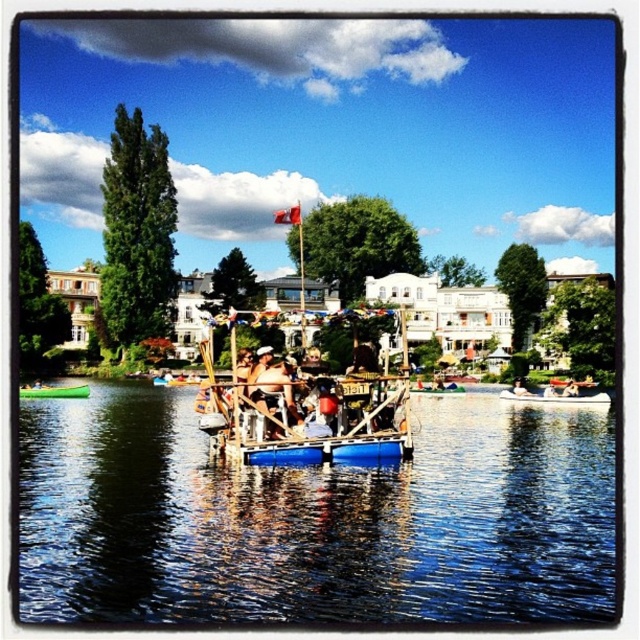
Is wooden raft at center wider than green plastic canoe at lower left?

Correct, the width of wooden raft at center exceeds that of green plastic canoe at lower left.

Is wooden raft at center further to camera compared to green plastic canoe at lower left?

No.

Between point (332, 380) and point (29, 388), which one is positioned behind?

The point (29, 388) is more distant.

Identify the location of wooden raft at center. (307, 410).

Does blue wooden raft at center have a greater width compared to wooden raft at center?

Indeed, blue wooden raft at center has a greater width compared to wooden raft at center.

Between blue wooden raft at center and wooden raft at center, which one has more height?

wooden raft at center

Where is `blue wooden raft at center`? Image resolution: width=640 pixels, height=640 pixels. blue wooden raft at center is located at coordinates (314, 518).

Find the location of a particular element. The height and width of the screenshot is (640, 640). blue wooden raft at center is located at coordinates (314, 518).

Describe the element at coordinates (307, 410) in the screenshot. I see `wooden raft at center` at that location.

How much distance is there between wooden raft at center and white plastic boat at center?

wooden raft at center and white plastic boat at center are 116.93 feet apart from each other.

Does point (337, 410) lie behind point (589, 401)?

No, it is not.

At what (x,y) coordinates should I click in order to perform the action: click on wooden raft at center. Please return your answer as a coordinate pair (x, y). The image size is (640, 640). Looking at the image, I should click on (307, 410).